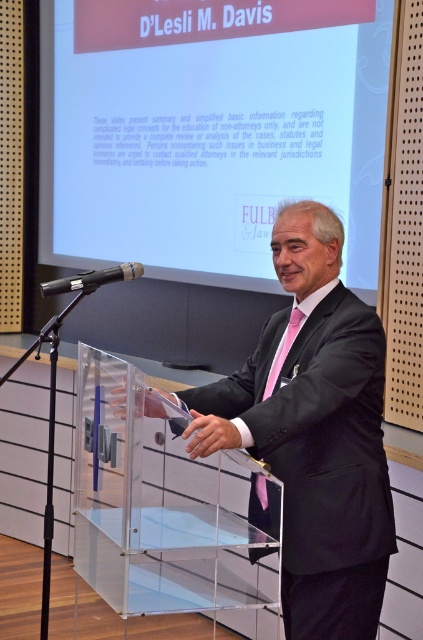
Is white matte projection screen at upper center closer to camera compared to black glossy suit at center?

No, white matte projection screen at upper center is further to the viewer.

Which is below, white matte projection screen at upper center or black glossy suit at center?

Positioned lower is black glossy suit at center.

Describe the element at coordinates (209, 131) in the screenshot. I see `white matte projection screen at upper center` at that location.

Identify the location of white matte projection screen at upper center. (209, 131).

Based on the photo, does black glossy suit at center come behind pink satin tie at center?

No.

Is black glossy suit at center taller than pink satin tie at center?

Indeed, black glossy suit at center has a greater height compared to pink satin tie at center.

Locate an element on the screen. black glossy suit at center is located at coordinates (313, 433).

Consider the image. Is black glossy suit at center bigger than black matte microphone at center?

Indeed, black glossy suit at center has a larger size compared to black matte microphone at center.

Locate an element on the screen. black glossy suit at center is located at coordinates (313, 433).